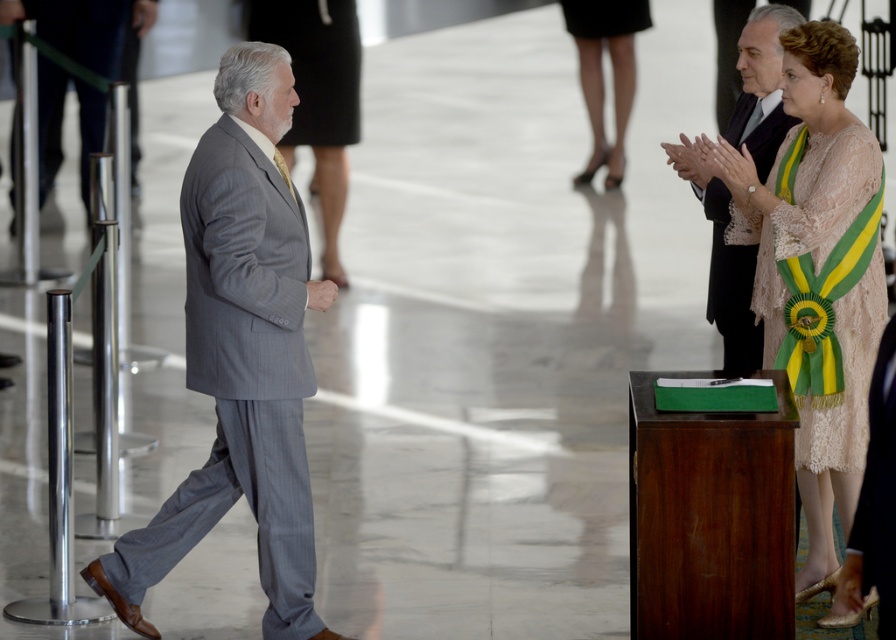
Question: Does lace dress at right lie behind black leather shoes at upper center?

Choices:
 (A) yes
 (B) no

Answer: (B)

Question: Which point is farther to the camera?

Choices:
 (A) matte black dress at center
 (B) black satin suit at right

Answer: (A)

Question: Among these points, which one is farthest from the camera?

Choices:
 (A) (252, 410)
 (B) (340, 10)
 (C) (807, 506)

Answer: (B)

Question: Is black satin suit at right above black leather shoes at upper center?

Choices:
 (A) yes
 (B) no

Answer: (B)

Question: Is lace dress at right thinner than black satin suit at right?

Choices:
 (A) no
 (B) yes

Answer: (A)

Question: Considering the real-world distances, which object is closest to the matte black dress at upper center?

Choices:
 (A) black satin suit at right
 (B) gray pinstripe suit at left

Answer: (A)